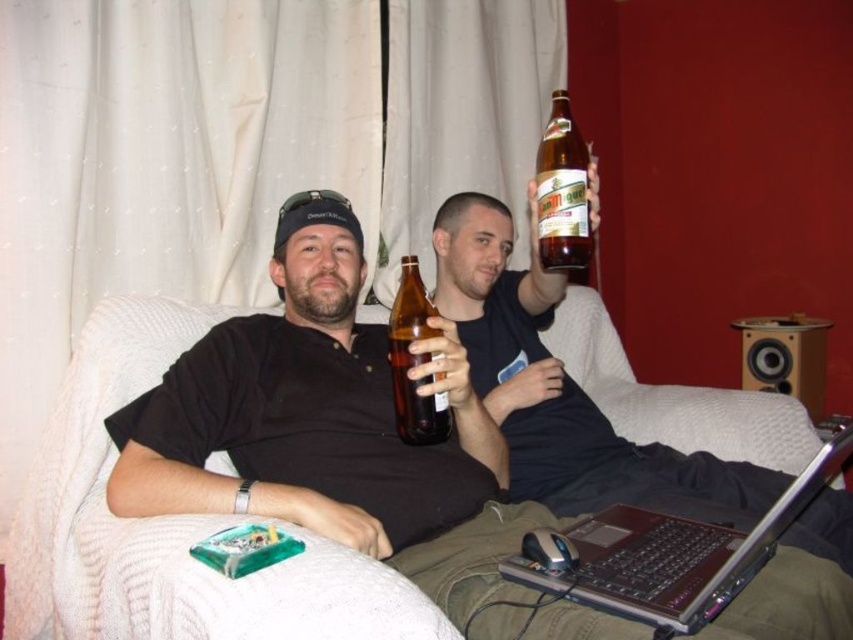
Which of these two, brown plastic laptop at lower center or brown glass bottle at upper center, stands taller?

Standing taller between the two is brown glass bottle at upper center.

Does brown plastic laptop at lower center have a greater height compared to brown glass bottle at upper center?

Incorrect, brown plastic laptop at lower center's height is not larger of brown glass bottle at upper center's.

Is point (560, 579) positioned behind point (577, 205)?

No, (560, 579) is in front of (577, 205).

Where is `brown plastic laptop at lower center`? The height and width of the screenshot is (640, 853). brown plastic laptop at lower center is located at coordinates (674, 554).

Who is more forward, [476,467] or [752,564]?

Point [752,564] is in front.

Find the location of `matte black shirt at center`. matte black shirt at center is located at coordinates (331, 433).

Does brown plastic laptop at lower center appear on the right side of brown glass bottle at center?

Yes, brown plastic laptop at lower center is to the right of brown glass bottle at center.

Which is below, brown plastic laptop at lower center or brown glass bottle at center?

A: Positioned lower is brown plastic laptop at lower center.

Where is `brown plastic laptop at lower center`? The width and height of the screenshot is (853, 640). brown plastic laptop at lower center is located at coordinates (674, 554).